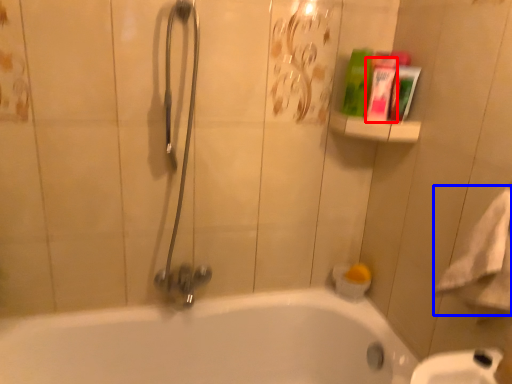
Question: Which object is closer to the camera taking this photo, mouthwash (highlighted by a red box) or bath towel (highlighted by a blue box)?

Choices:
 (A) mouthwash
 (B) bath towel

Answer: (B)